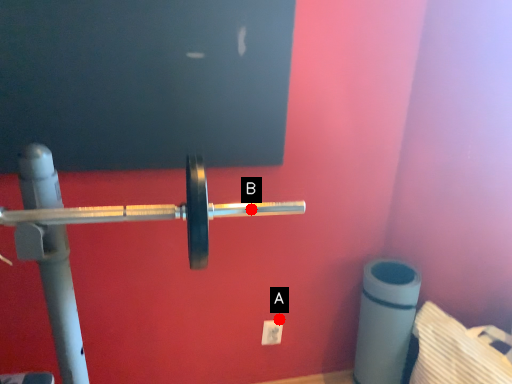
Question: Two points are circled on the image, labeled by A and B beside each circle. Which of the following is the closest to the observer?

Choices:
 (A) A is closer
 (B) B is closer

Answer: (B)